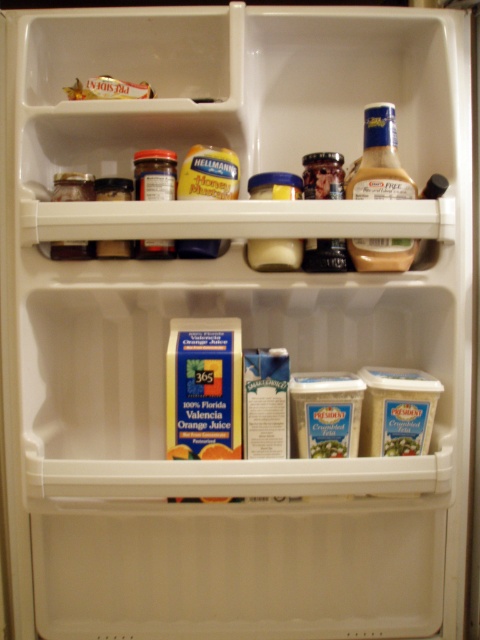
You are organizing the fridge and want to place a new item between the translucent plastic mustard at upper right and the gold foil packet at upper left. Is there enough space between them for a 5 cm wide item?

The translucent plastic mustard at upper right is in front of the gold foil packet at upper left, so there is space between them. The 5 cm wide item can be placed between them.

You are organizing the fridge and need to place a new item between the translucent plastic mustard at upper right and the gold foil packet at upper left. Based on their current positions, which side should you place the new item to ensure it is between them?

You should place the new item to the right of the gold foil packet at upper left and to the left of the translucent plastic mustard at upper right since the mustard is to the right of the packet.

You are organizing items in the refrigerator and need to place a new item at point (380, 160). Is there already an item occupying that location?

Yes, there is a translucent plastic mustard at upper right located at point (380, 160).